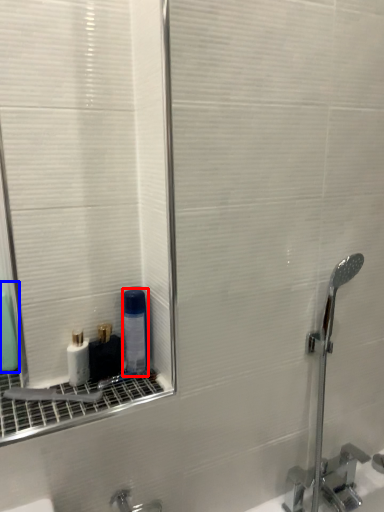
Question: Which object appears closest to the camera in this image, mouthwash (highlighted by a red box) or mouthwash (highlighted by a blue box)?

Choices:
 (A) mouthwash
 (B) mouthwash

Answer: (A)